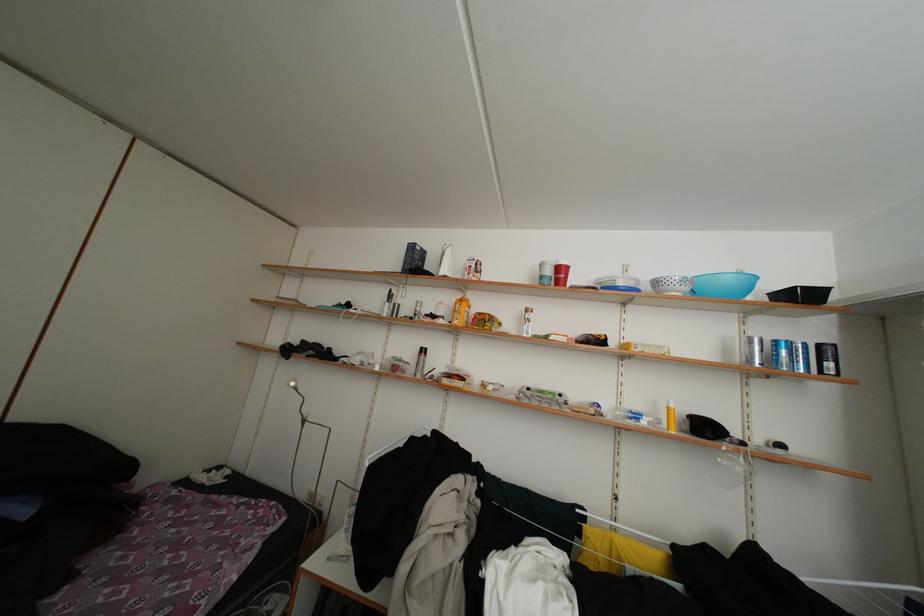
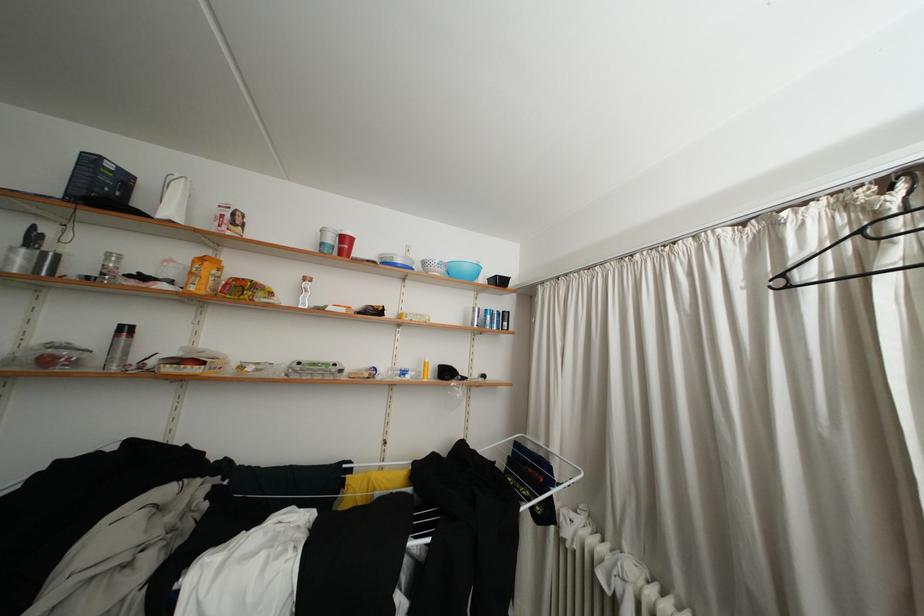
Find the pixel in the second image that matches (x=464, y=328) in the first image.

(200, 294)